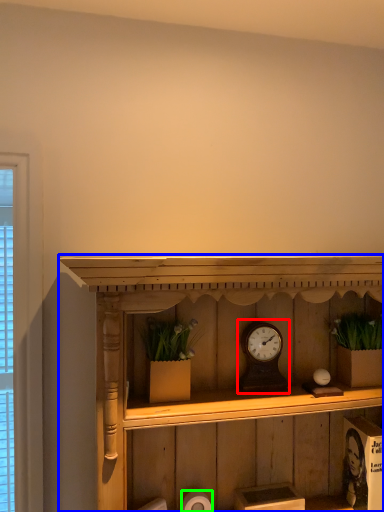
Question: Estimate the real-world distances between objects in this image. Which object is farther from alarm clock (highlighted by a red box), shelf (highlighted by a blue box) or toilet paper (highlighted by a green box)?

Choices:
 (A) shelf
 (B) toilet paper

Answer: (B)